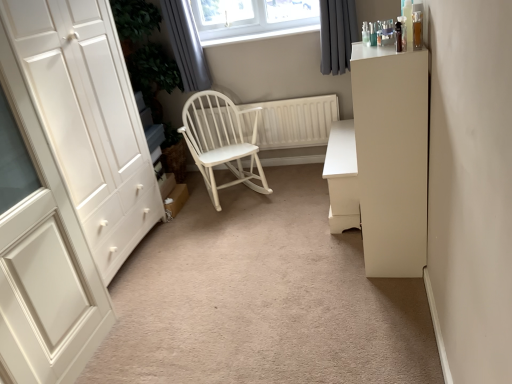
Identify the location of blank space to the left of white matte cabinet at right. The image size is (512, 384). (331, 259).